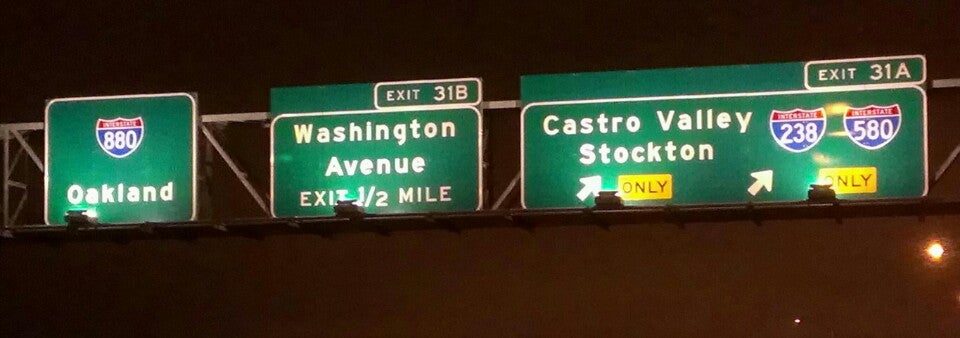
This screenshot has height=338, width=960. I want to click on light, so click(x=608, y=204), click(x=823, y=196), click(x=344, y=206), click(x=69, y=223), click(x=938, y=249).